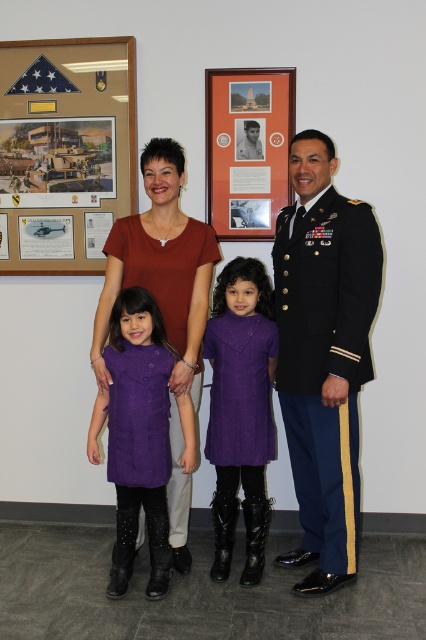
Question: Can you confirm if matte brown shirt at center is thinner than shiny black uniform at right?

Choices:
 (A) no
 (B) yes

Answer: (A)

Question: Is navy blue wool military uniform at right above shiny black uniform at right?

Choices:
 (A) no
 (B) yes

Answer: (A)

Question: Which point is farther to the camera?

Choices:
 (A) (333, 285)
 (B) (253, 157)
 (C) (232, 301)
 (D) (49, 232)

Answer: (D)

Question: Which object appears farthest from the camera in this image?

Choices:
 (A) matte wooden picture frame at center
 (B) matte brown shirt at center
 (C) matte black flag at upper left
 (D) purple textured dress at center

Answer: (C)

Question: Among these points, which one is farthest from the camera?

Choices:
 (A) (97, 168)
 (B) (322, 228)
 (C) (267, 186)

Answer: (A)

Question: Is purple woolen dress at center further to the viewer compared to matte brown shirt at center?

Choices:
 (A) yes
 (B) no

Answer: (B)